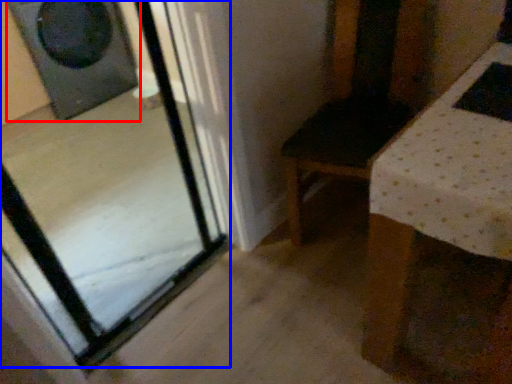
Question: Which point is further to the camera, speaker (highlighted by a red box) or glass door (highlighted by a blue box)?

Choices:
 (A) speaker
 (B) glass door

Answer: (A)